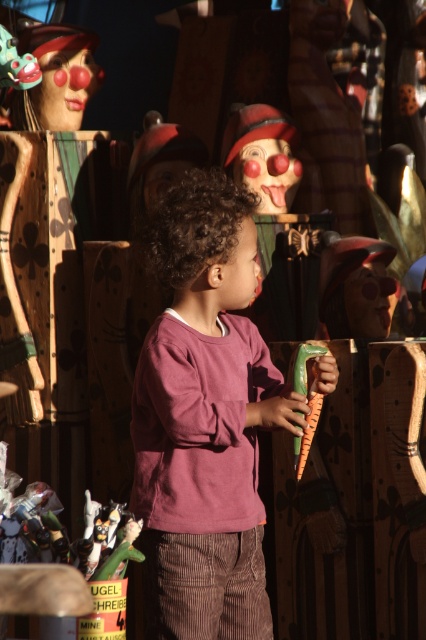
Which of these two, purple cotton shirt at center or matte plastic clown head at upper left, stands taller?

Standing taller between the two is purple cotton shirt at center.

The image size is (426, 640). What do you see at coordinates (204, 419) in the screenshot? I see `purple cotton shirt at center` at bounding box center [204, 419].

Where is `purple cotton shirt at center`? The width and height of the screenshot is (426, 640). purple cotton shirt at center is located at coordinates (204, 419).